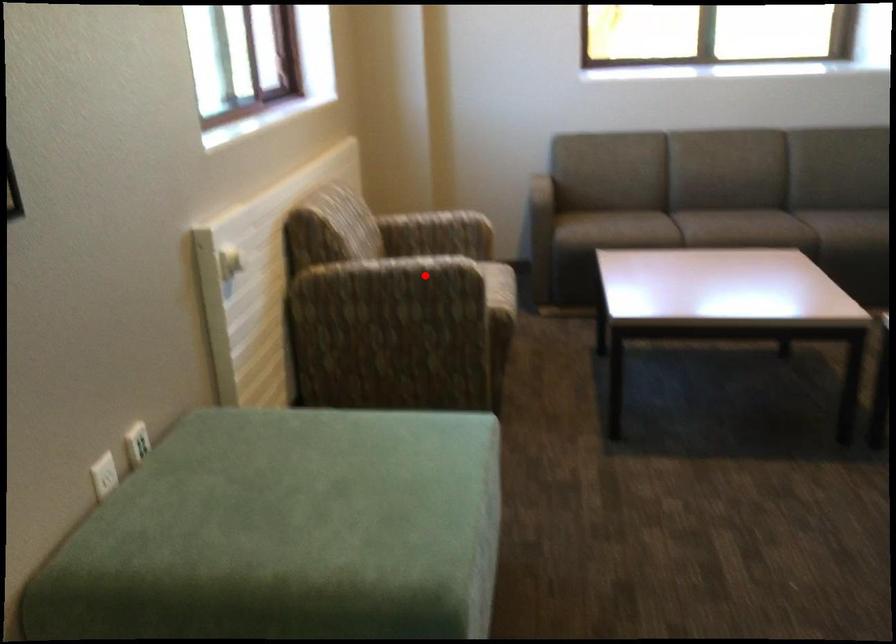
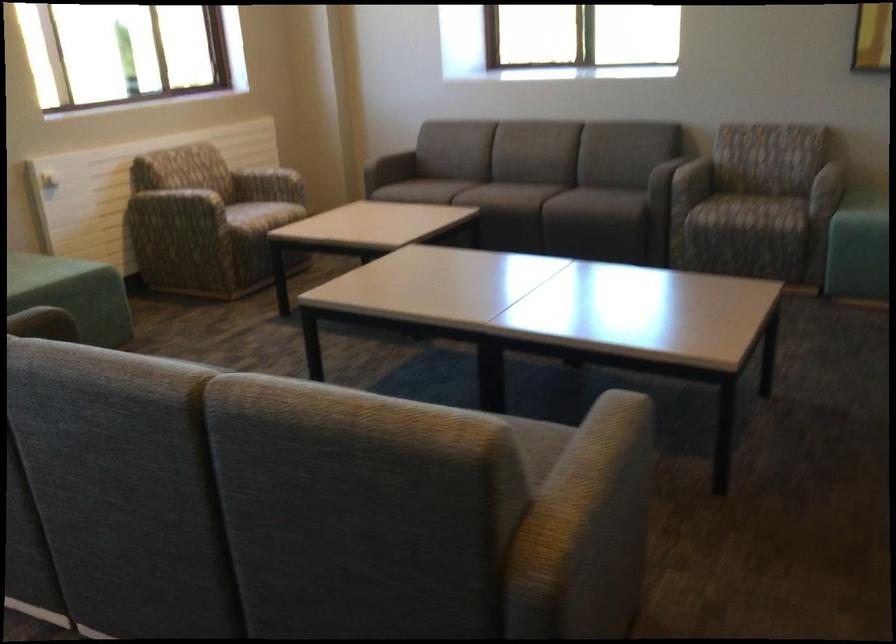
The point at the highlighted location is marked in the first image. Where is the corresponding point in the second image?

(179, 204)